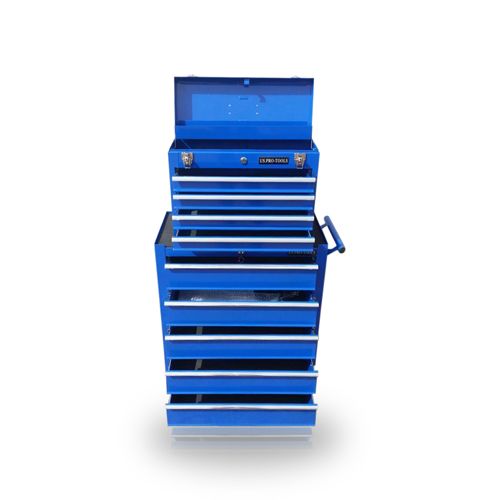
At what (x,y) coordinates should I click in order to perform the action: click on bottom latches. Please return your answer as a coordinate pair (x, y). This screenshot has height=500, width=500. Looking at the image, I should click on (302, 158), (186, 161).